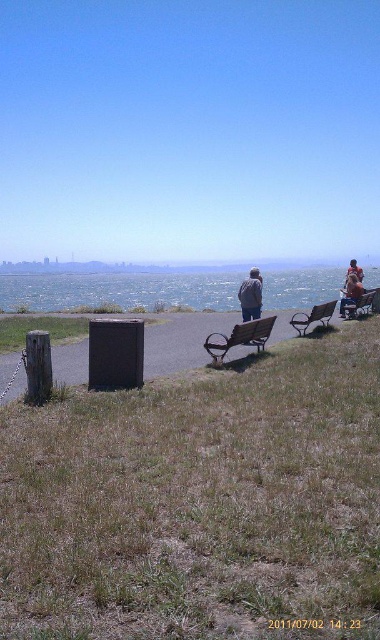
Question: Which point is farther to the camera?

Choices:
 (A) rustic wood bench at center
 (B) blue water at center
 (C) wooden park bench at center

Answer: (B)

Question: Does blue water at center have a lesser width compared to wooden park bench at center?

Choices:
 (A) yes
 (B) no

Answer: (B)

Question: Is rustic wood bench at center wider than wooden park bench at center?

Choices:
 (A) yes
 (B) no

Answer: (A)

Question: Which point is farther from the camera taking this photo?

Choices:
 (A) (242, 332)
 (B) (311, 419)
 (C) (25, 307)

Answer: (C)

Question: Considering the real-world distances, which object is closest to the dry grass at lower left?

Choices:
 (A) wooden park bench at center
 (B) rustic wood bench at center
 (C) wooden bench at center
 (D) denim jacket at center

Answer: (B)

Question: Does dry grass at lower left appear on the right side of blue water at center?

Choices:
 (A) yes
 (B) no

Answer: (B)